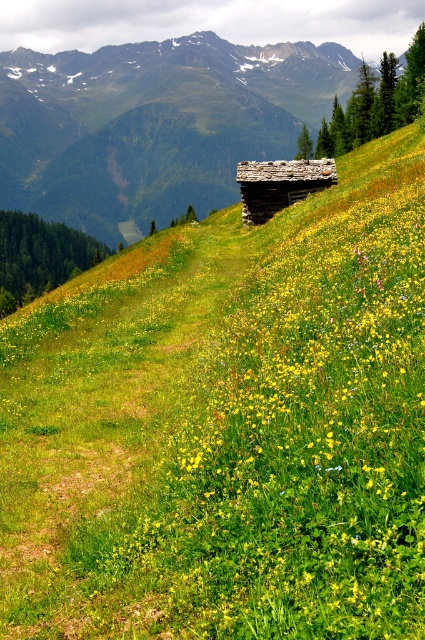
You are planning to build a garden between the rustic wooden cabin at center and the rustic wooden log cabin at center. Given that the distance between them is 1237.44 feet, what is the maximum length of a straight garden path you can construct between them without deviating from the straight line?

The maximum length of a straight garden path you can construct between the rustic wooden cabin at center and the rustic wooden log cabin at center is 1237.44 feet, as they are 1237.44 feet apart from each other.

You are hiking up a mountain path and notice two rustic wooden structures ahead. The first is labeled as the rustic wooden cabin at center, and the second is the rustic wooden log cabin at center. Which structure is positioned higher up the slope?

The rustic wooden cabin at center is positioned higher up the slope than the rustic wooden log cabin at center according to the description.

You are planning to place a new garden bench between the rustic wooden cabin at center and the rustic wooden log cabin at center. Which cabin should the bench be closer to if you want it to be equidistant from both cabins?

The bench should be closer to the rustic wooden log cabin at center because it is smaller in size and therefore requires less space between them to maintain equal distance.